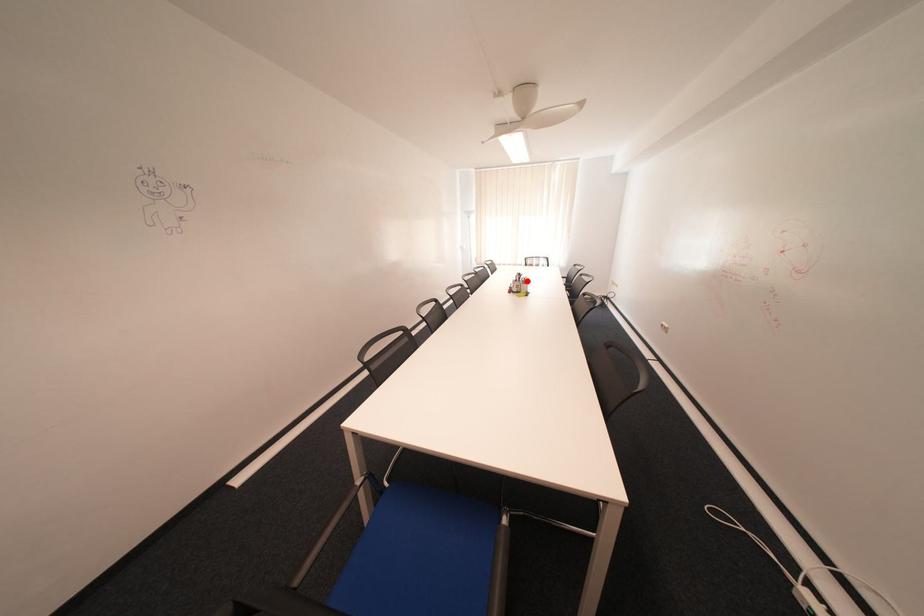
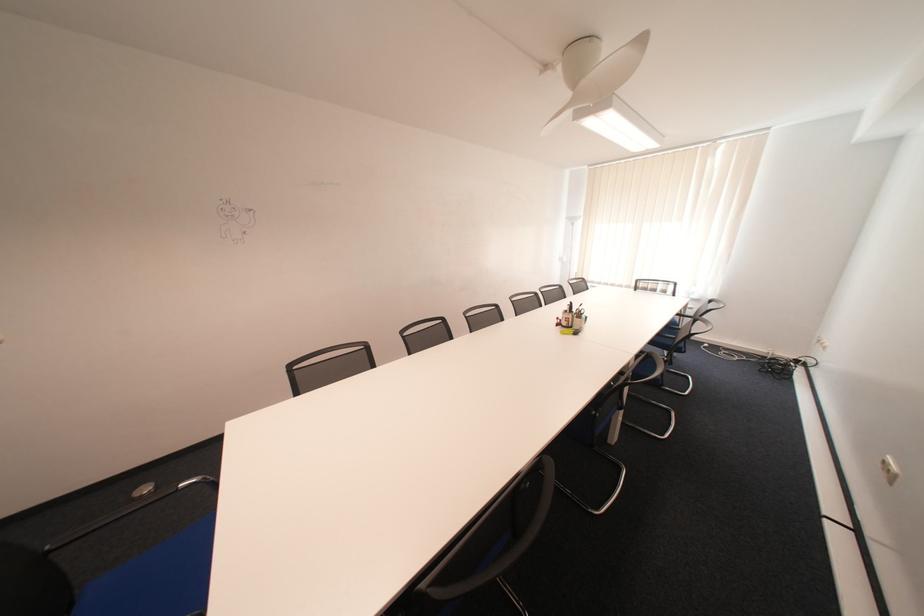
The point at the highlighted location is marked in the first image. Where is the corresponding point in the second image?

(578, 312)